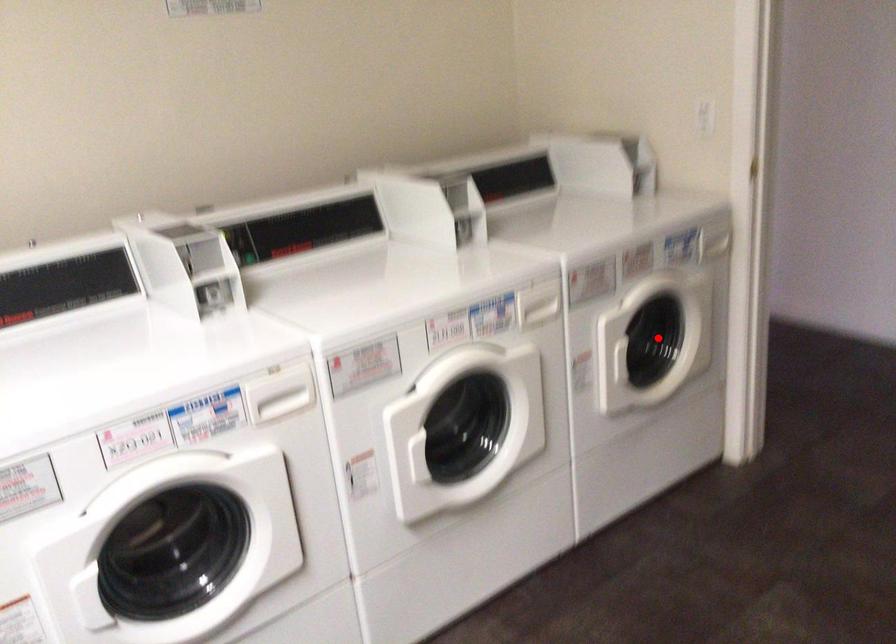
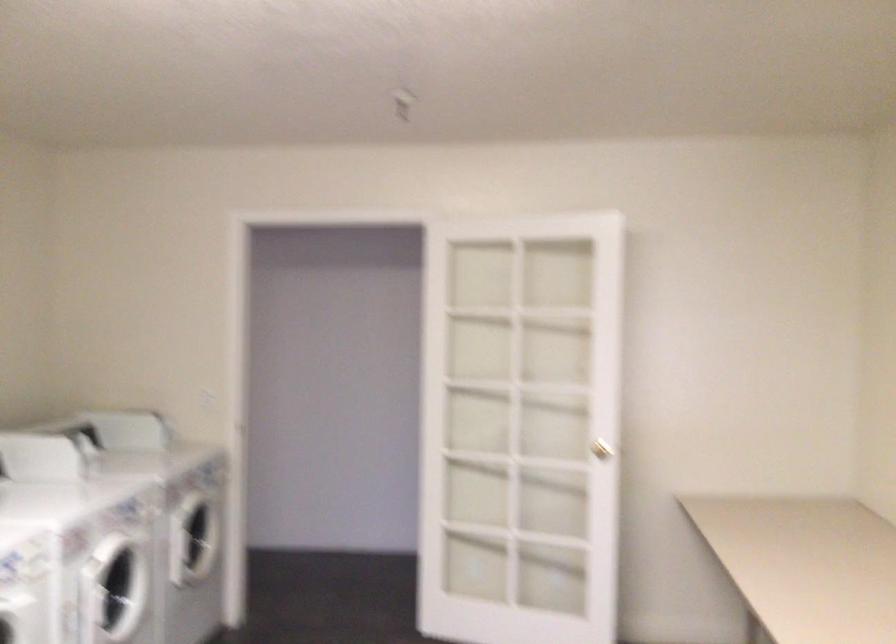
Question: I am providing you with two images of the same scene from different viewpoints. A red point is marked on the first image. At the location where the point appears in image 1, is it still visible in image 2?

Choices:
 (A) Yes
 (B) No

Answer: (B)